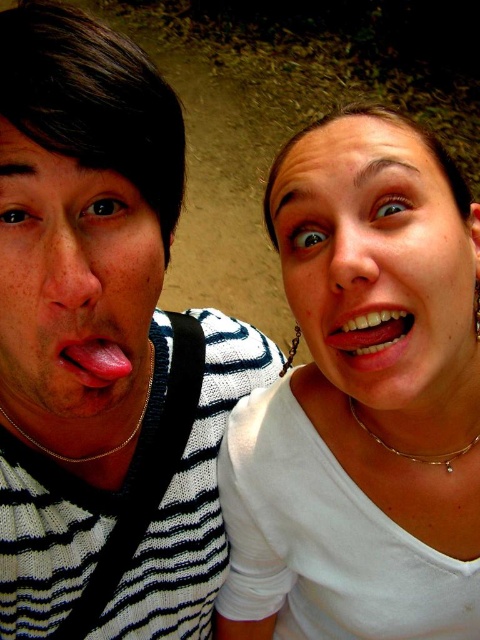
Is striped knit sweater at left thinner than smooth white face at center?

Incorrect, striped knit sweater at left's width is not less than smooth white face at center's.

Who is lower down, striped knit sweater at left or smooth white face at center?

Positioned lower is striped knit sweater at left.

The image size is (480, 640). What do you see at coordinates (106, 337) in the screenshot?
I see `striped knit sweater at left` at bounding box center [106, 337].

At what (x,y) coordinates should I click in order to perform the action: click on striped knit sweater at left. Please return your answer as a coordinate pair (x, y). The height and width of the screenshot is (640, 480). Looking at the image, I should click on (106, 337).

Which is more to the left, smooth white face at center or silver chain necklace at lower center?

smooth white face at center

Does smooth white face at center have a smaller size compared to silver chain necklace at lower center?

Incorrect, smooth white face at center is not smaller in size than silver chain necklace at lower center.

Where is `smooth white face at center`? The height and width of the screenshot is (640, 480). smooth white face at center is located at coordinates (372, 154).

Looking at this image, is striped knit sweater at left above gold chain at left?

Correct, striped knit sweater at left is located above gold chain at left.

The image size is (480, 640). Describe the element at coordinates (106, 337) in the screenshot. I see `striped knit sweater at left` at that location.

The image size is (480, 640). What are the coordinates of `striped knit sweater at left` in the screenshot? It's located at (106, 337).

Image resolution: width=480 pixels, height=640 pixels. I want to click on striped knit sweater at left, so click(x=106, y=337).